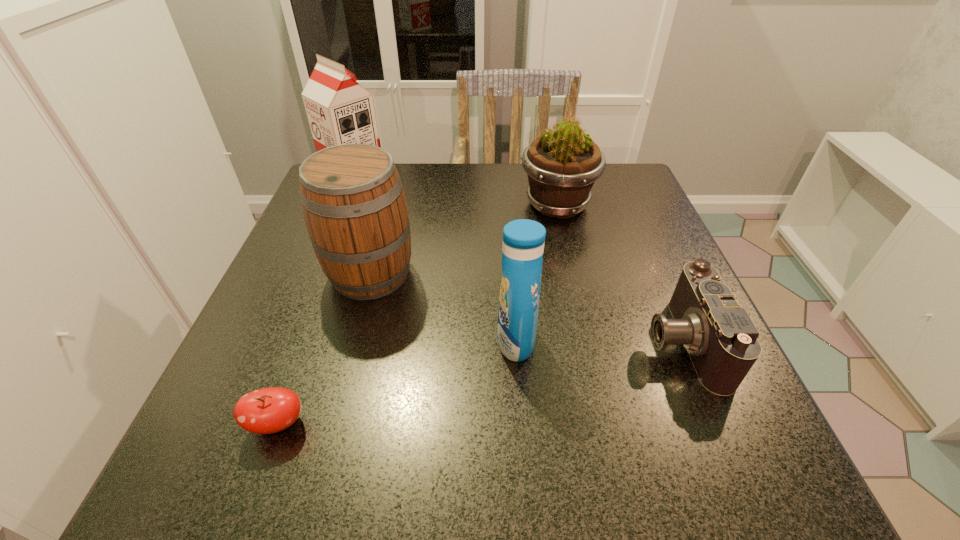
This screenshot has width=960, height=540. I want to click on free space between the flowerpot and the soya milk, so click(x=456, y=193).

Where is `vacant area between the detergent and the nearest object`? vacant area between the detergent and the nearest object is located at coordinates (396, 382).

The height and width of the screenshot is (540, 960). I want to click on unoccupied position between the shortest object and the detergent, so click(x=396, y=382).

What are the coordinates of `free space between the detergent and the shortest object` in the screenshot? It's located at (396, 382).

Locate which object is the fourth closest to the second shortest object. Please provide its 2D coordinates. Your answer should be formatted as a tuple, i.e. [(x, y)], where the tuple contains the x and y coordinates of a point satisfying the conditions above.

[(269, 410)]

Where is `the third closest object relative to the flowerpot`? the third closest object relative to the flowerpot is located at coordinates (523, 240).

Image resolution: width=960 pixels, height=540 pixels. Find the location of `free spot that satisfies the following two spatial constraints: 1. on the front side of the tallest object; 2. on the left side of the flowerpot`. free spot that satisfies the following two spatial constraints: 1. on the front side of the tallest object; 2. on the left side of the flowerpot is located at coordinates (347, 205).

Find the location of a particular element. The image size is (960, 540). vacant point that satisfies the following two spatial constraints: 1. on the back side of the flowerpot; 2. on the right side of the cider is located at coordinates (389, 205).

What are the coordinates of `vacant space that satisfies the following two spatial constraints: 1. on the front side of the tallest object; 2. on the left side of the cider` in the screenshot? It's located at (320, 273).